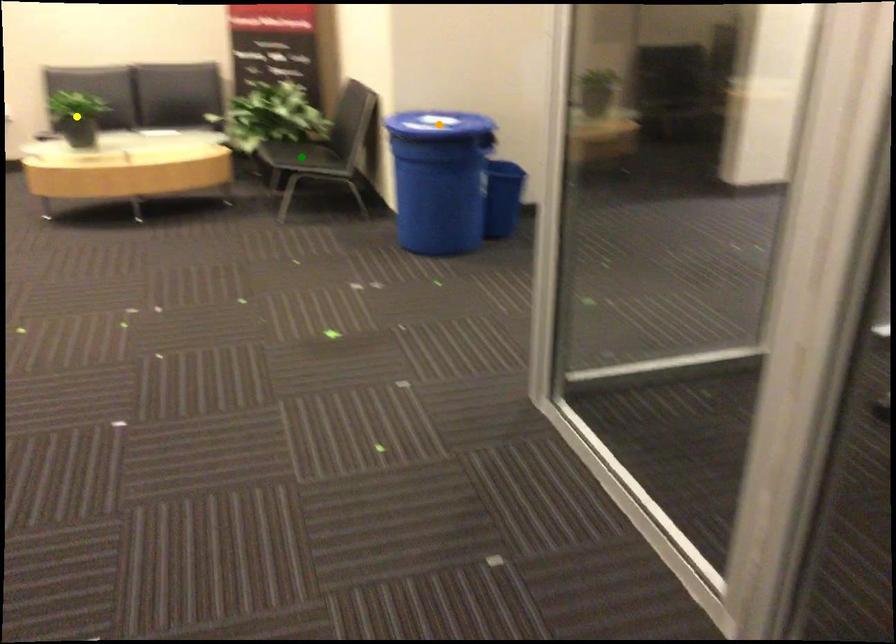
Order these from nearest to farthest:
A) yellow point
B) green point
C) orange point

yellow point < green point < orange point